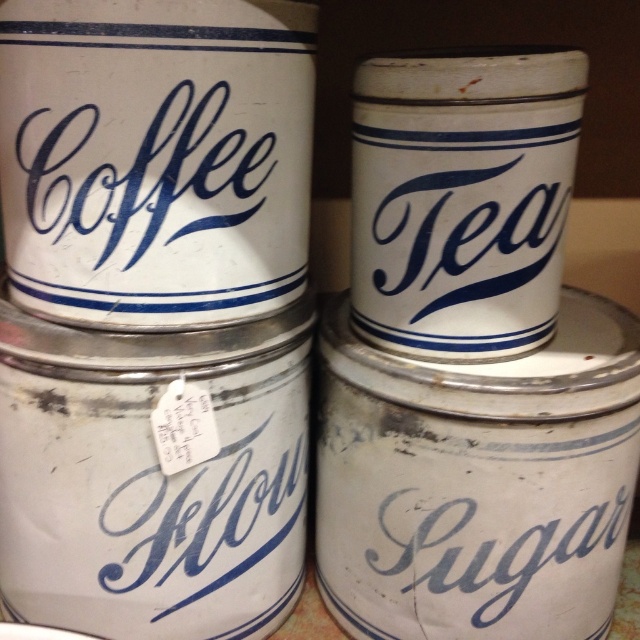
Is blue painted metal tea at upper right below white paper tag at lower center?

No.

Is point (476, 230) more distant than point (234, 547)?

No, (476, 230) is in front of (234, 547).

Is point (490, 268) in front of point (108, 506)?

Yes, it is.

Where is `blue painted metal tea at upper right`? This screenshot has width=640, height=640. blue painted metal tea at upper right is located at coordinates (456, 228).

From the picture: Who is higher up, matte blue script coffee at upper left or white paper tag at lower center?

matte blue script coffee at upper left is above.

Who is lower down, matte blue script coffee at upper left or white paper tag at lower center?

white paper tag at lower center is lower down.

The image size is (640, 640). In order to click on matte blue script coffee at upper left in this screenshot , I will do `click(141, 173)`.

Who is positioned more to the left, white matte sugar at lower right or white paper tag at lower center?

From the viewer's perspective, white paper tag at lower center appears more on the left side.

Between point (550, 580) and point (160, 529), which one is positioned behind?

The point (550, 580) is behind.

Where is `white matte sugar at lower right`? white matte sugar at lower right is located at coordinates (496, 566).